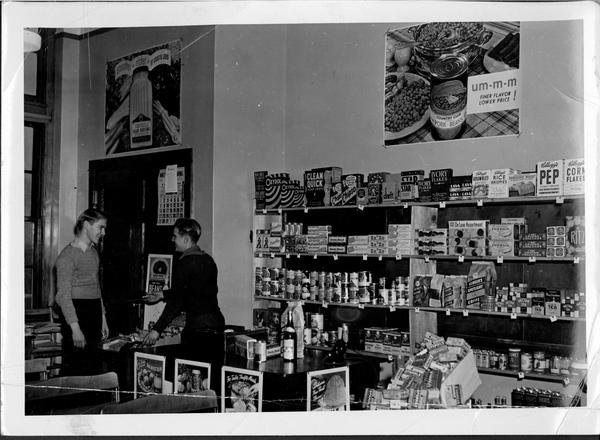
Identify the location of shelves. (378, 223), (466, 257), (395, 202), (375, 297), (375, 335), (532, 346), (526, 306), (518, 186).